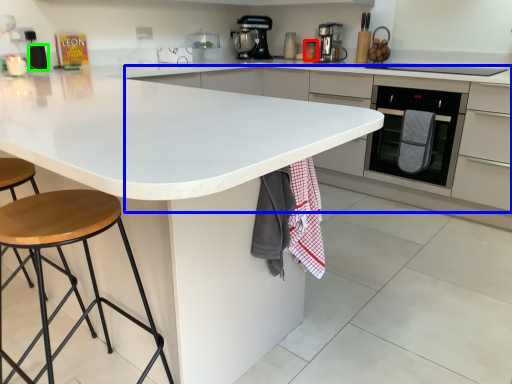
Question: Estimate the real-world distances between objects in this image. Which object is farther from appliance (highlighted by a red box), cabinetry (highlighted by a blue box) or appliance (highlighted by a green box)?

Choices:
 (A) cabinetry
 (B) appliance

Answer: (B)